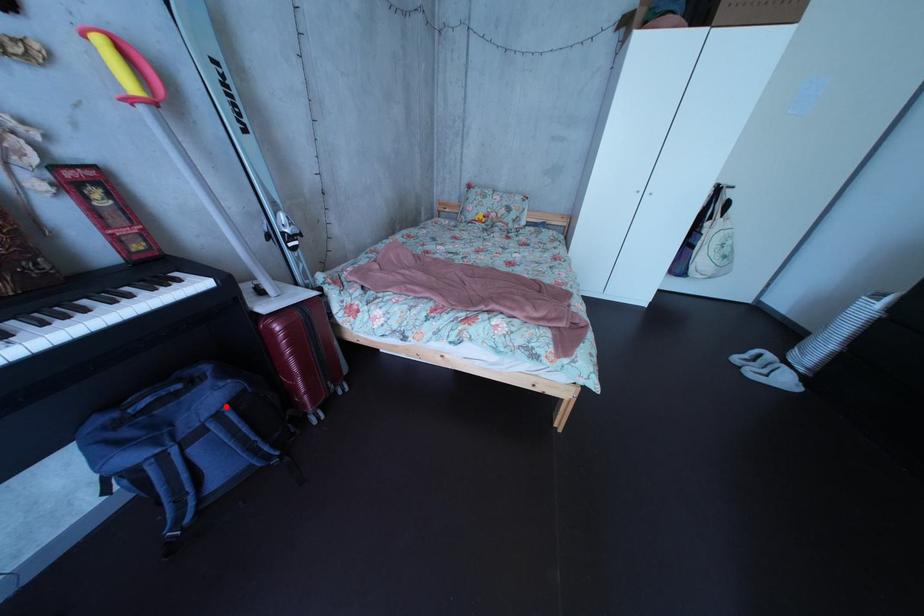
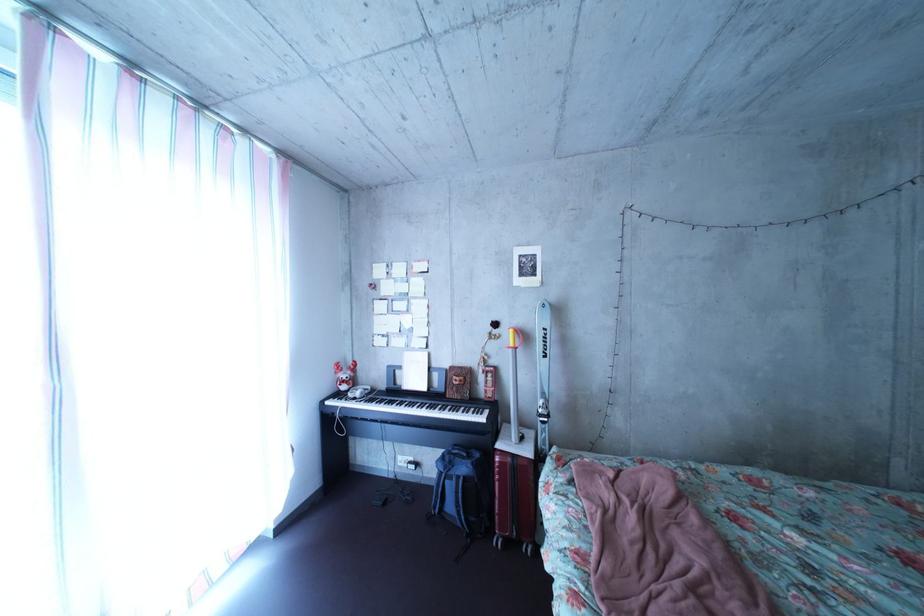
Question: I am providing you with two images of the same scene from different viewpoints. A red point is shown in image1. For the corresponding object point in image2, is it positioned nearer or farther from the camera?

Choices:
 (A) Nearer
 (B) Farther

Answer: (B)